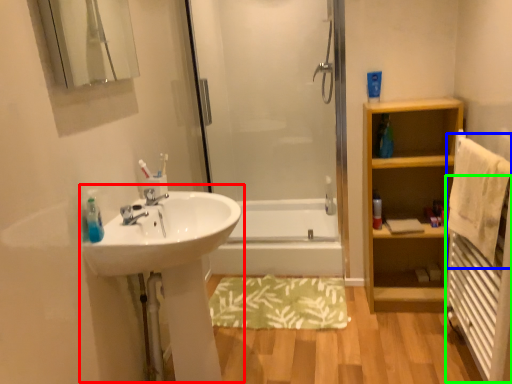
Question: Estimate the real-world distances between objects in this image. Which object is farther from sink (highlighted by a red box), bath towel (highlighted by a blue box) or radiator (highlighted by a green box)?

Choices:
 (A) bath towel
 (B) radiator

Answer: (B)